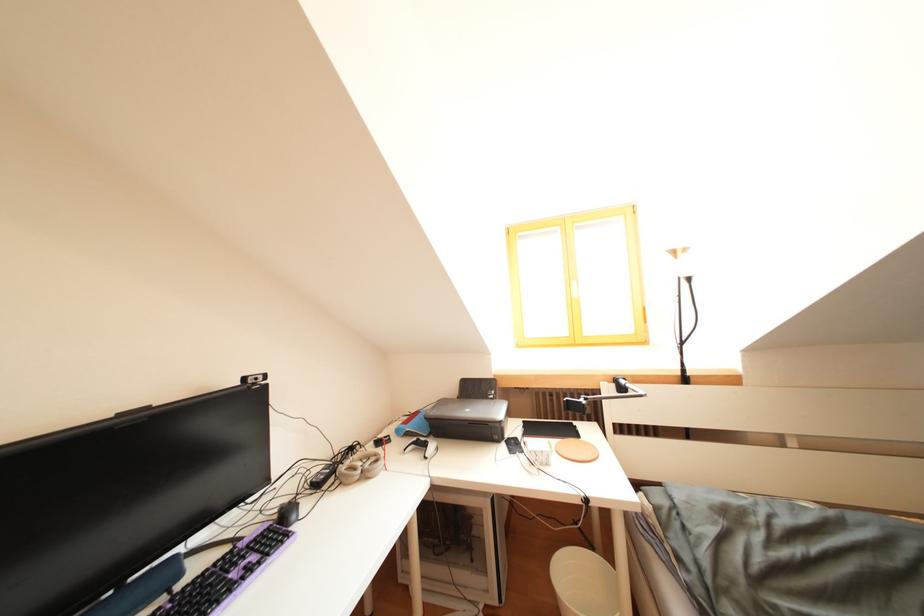
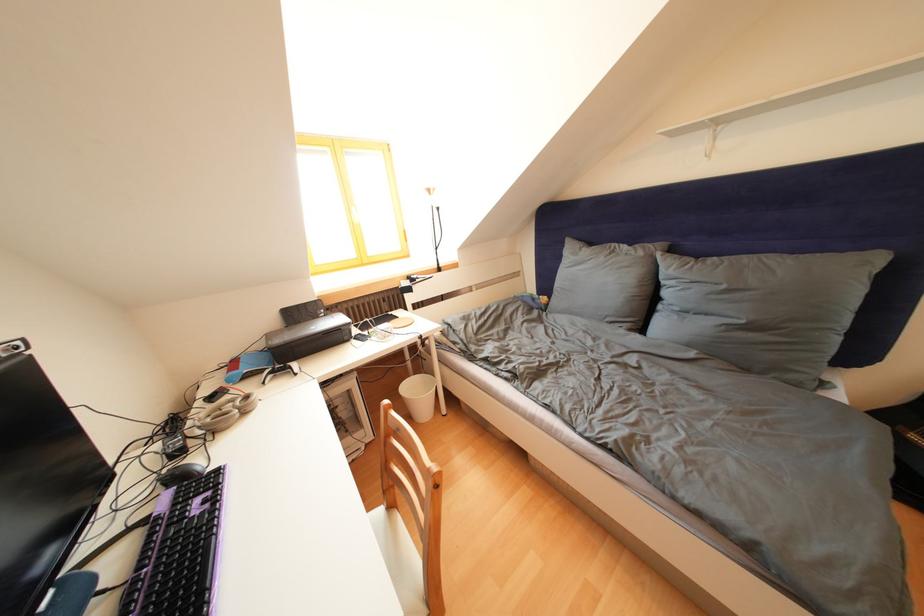
Where in the second image is the point corresponding to point (386, 447) from the first image?

(220, 403)